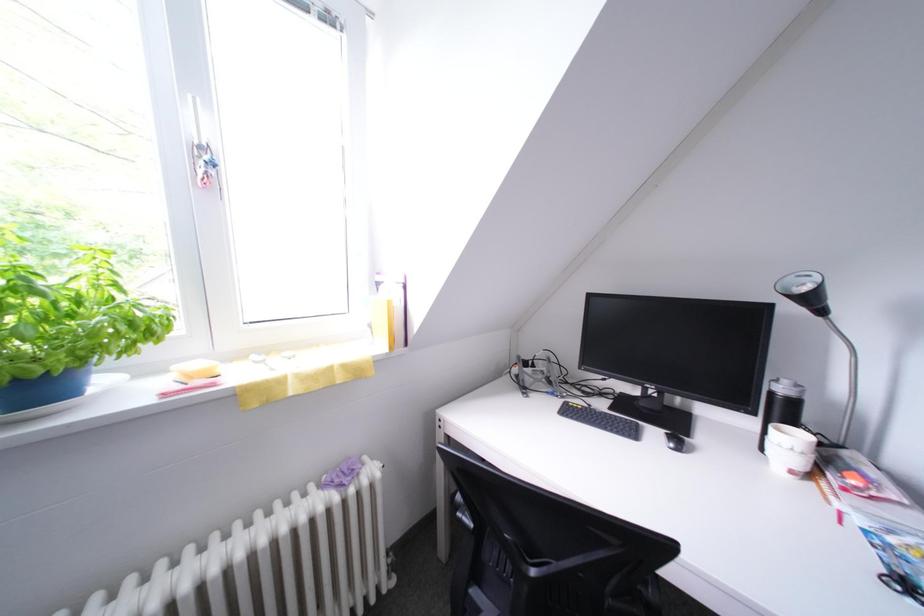
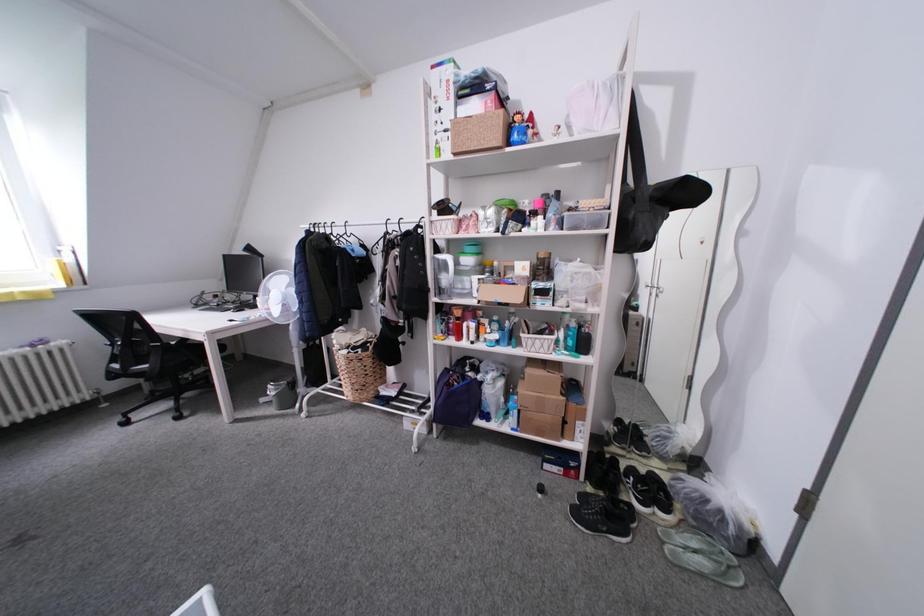
What movement of the cameraman would produce the second image?

The cameraman walked toward right, backward.